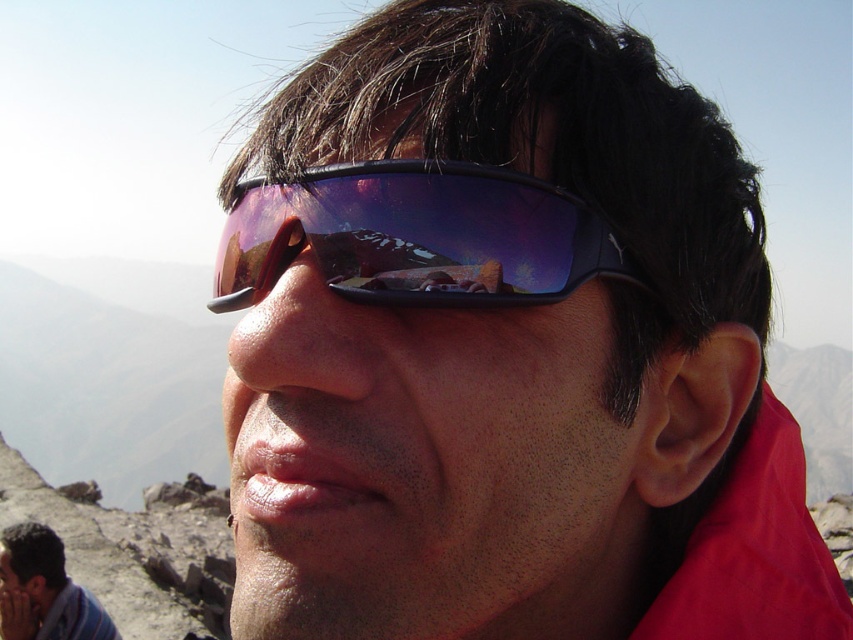
Is purple reflective lens at center in front of matte blue sunglasses at lower left?

Yes.

Does purple reflective lens at center have a greater height compared to matte blue sunglasses at lower left?

Incorrect, purple reflective lens at center's height is not larger of matte blue sunglasses at lower left's.

Where is `purple reflective lens at center`? The width and height of the screenshot is (853, 640). purple reflective lens at center is located at coordinates (416, 236).